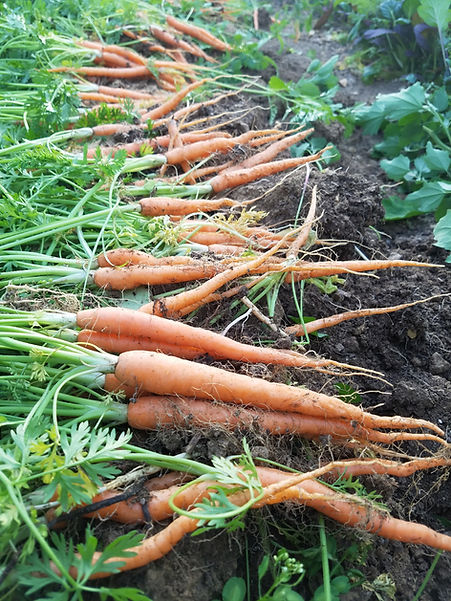
Locate an element on the screen. plant leaves is located at coordinates (410, 106), (428, 186).